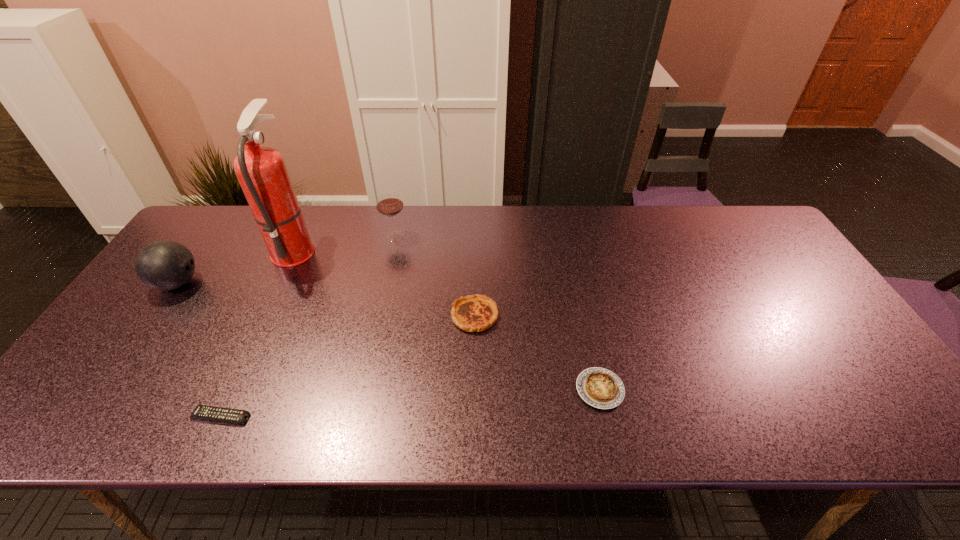
Where is `vacant area between the leftmost object and the shortest object`? The image size is (960, 540). vacant area between the leftmost object and the shortest object is located at coordinates (199, 350).

This screenshot has height=540, width=960. In order to click on free space between the bowling ball and the shortest object in this screenshot , I will do `click(199, 350)`.

Select which object is the closest to the right quiche. Please provide its 2D coordinates. Your answer should be formatted as a tuple, i.e. [(x, y)], where the tuple contains the x and y coordinates of a point satisfying the conditions above.

[(475, 313)]

Select which object appears as the fourth closest to the wineglass. Please provide its 2D coordinates. Your answer should be formatted as a tuple, i.e. [(x, y)], where the tuple contains the x and y coordinates of a point satisfying the conditions above.

[(214, 413)]

Locate an element on the screen. The height and width of the screenshot is (540, 960). vacant point that satisfies the following two spatial constraints: 1. with the handle and hose on the fourth tallest object; 2. on the left side of the tallest object is located at coordinates (264, 316).

This screenshot has width=960, height=540. Find the location of `vacant area that satisfies the following two spatial constraints: 1. with the handle and hose on the taller quiche; 2. on the right side of the fire extinguisher`. vacant area that satisfies the following two spatial constraints: 1. with the handle and hose on the taller quiche; 2. on the right side of the fire extinguisher is located at coordinates (264, 316).

Identify the location of blank area in the image that satisfies the following two spatial constraints: 1. on the back side of the second object from right to left; 2. with the handle and hose on the fire extinguisher. (475, 249).

Where is `free space that satisfies the following two spatial constraints: 1. with the handle and hose on the fire extinguisher; 2. on the back side of the right quiche`? Image resolution: width=960 pixels, height=540 pixels. free space that satisfies the following two spatial constraints: 1. with the handle and hose on the fire extinguisher; 2. on the back side of the right quiche is located at coordinates (229, 389).

Locate an element on the screen. free space that satisfies the following two spatial constraints: 1. on the back side of the shortest object; 2. with the handle and hose on the tallest object is located at coordinates (298, 249).

Where is `vacant area in the image that satisfies the following two spatial constraints: 1. on the grip area of the leftmost object; 2. on the left side of the fifth object from left to right`? vacant area in the image that satisfies the following two spatial constraints: 1. on the grip area of the leftmost object; 2. on the left side of the fifth object from left to right is located at coordinates (155, 316).